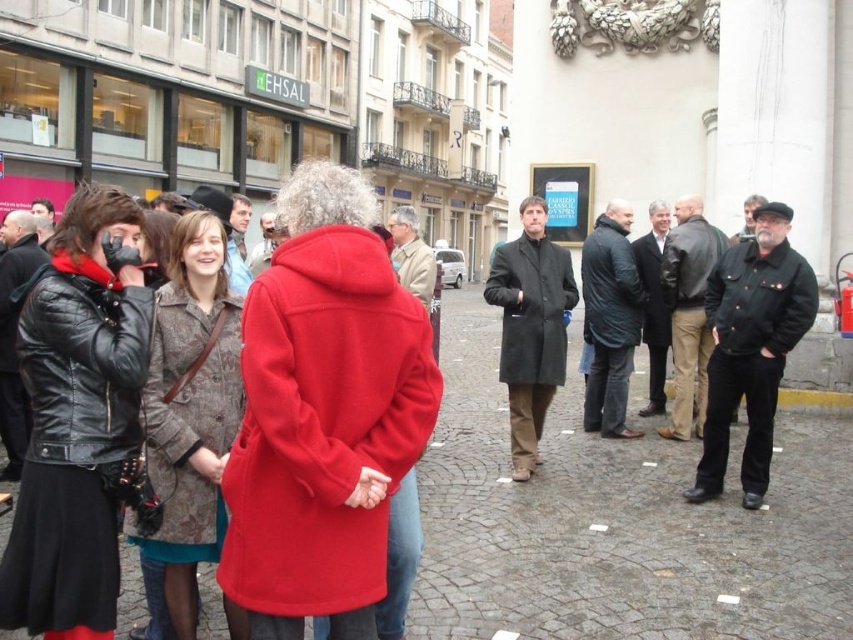
Question: Can you confirm if brown textured coat at center left is positioned below dark gray matte coat at center?

Choices:
 (A) yes
 (B) no

Answer: (A)

Question: Which object appears closest to the camera in this image?

Choices:
 (A) brown textured coat at center left
 (B) dark gray wool coat at center
 (C) leather jacket at center
 (D) matte beige coat at center

Answer: (A)

Question: Does cobblestone pavement at center have a lesser width compared to leather jacket at center?

Choices:
 (A) no
 (B) yes

Answer: (A)

Question: Which of the following is the farthest from the observer?

Choices:
 (A) (258, 435)
 (B) (827, 438)
 (C) (97, 512)
 (D) (206, 454)

Answer: (B)

Question: Is black leather jacket at left smaller than matte black leather jacket at left?

Choices:
 (A) no
 (B) yes

Answer: (A)

Question: Among these points, which one is farthest from the camera?

Choices:
 (A) (602, 285)
 (B) (178, 253)
 (C) (699, 256)
 (D) (415, 250)

Answer: (A)